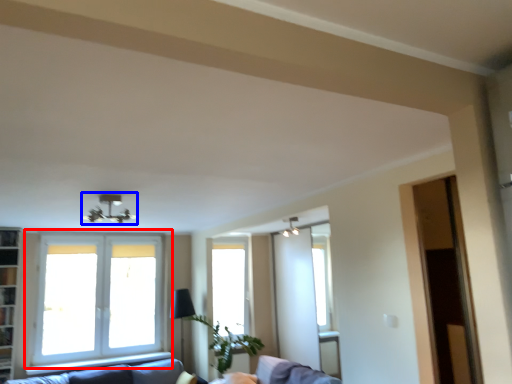
Question: Which point is closer to the camera, window (highlighted by a red box) or light fixture (highlighted by a blue box)?

Choices:
 (A) window
 (B) light fixture

Answer: (B)